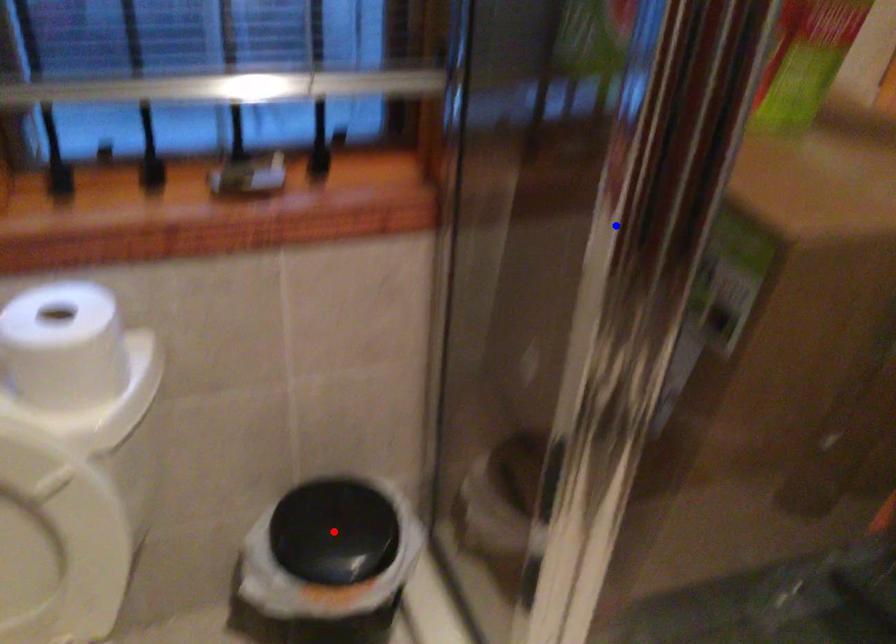
Question: Which of the two points in the image is closer to the camera?

Choices:
 (A) Blue point is closer.
 (B) Red point is closer.

Answer: (A)